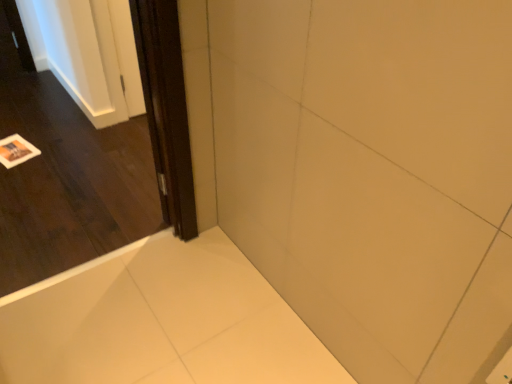
I want to click on vacant space underneath dark wood door at left (from a real-world perspective), so click(x=98, y=269).